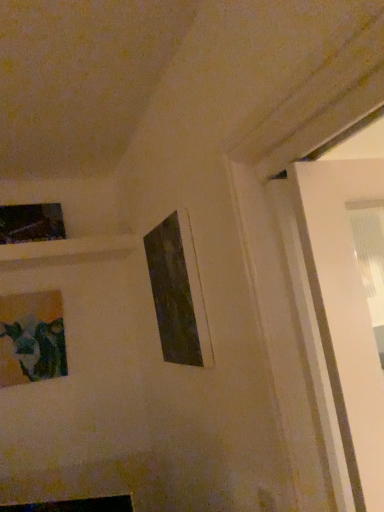
Question: Considering the positions of matte black picture frame at center, placed as the first picture frame when sorted from front to back, and matte glass picture frame at lower left, the second picture frame from the right, in the image, is matte black picture frame at center, placed as the first picture frame when sorted from front to back, wider or thinner than matte glass picture frame at lower left, the second picture frame from the right,?

Choices:
 (A) wide
 (B) thin

Answer: (B)

Question: In terms of size, does matte black picture frame at center, placed as the first picture frame when sorted from front to back, appear bigger or smaller than matte glass picture frame at lower left, acting as the second picture frame starting from the back?

Choices:
 (A) big
 (B) small

Answer: (A)

Question: Which object is positioned closest to the matte black picture frame at upper left, which is the 3th picture frame in right-to-left order?

Choices:
 (A) matte black picture frame at center, placed as the first picture frame when sorted from front to back
 (B) matte glass picture frame at lower left, acting as the second picture frame starting from the back

Answer: (B)

Question: Which is farther from the matte black picture frame at upper left, the first picture frame from the left?

Choices:
 (A) matte black picture frame at center, the 3th picture frame positioned from the left
 (B) matte glass picture frame at lower left, which is the 2th picture frame from left to right

Answer: (A)